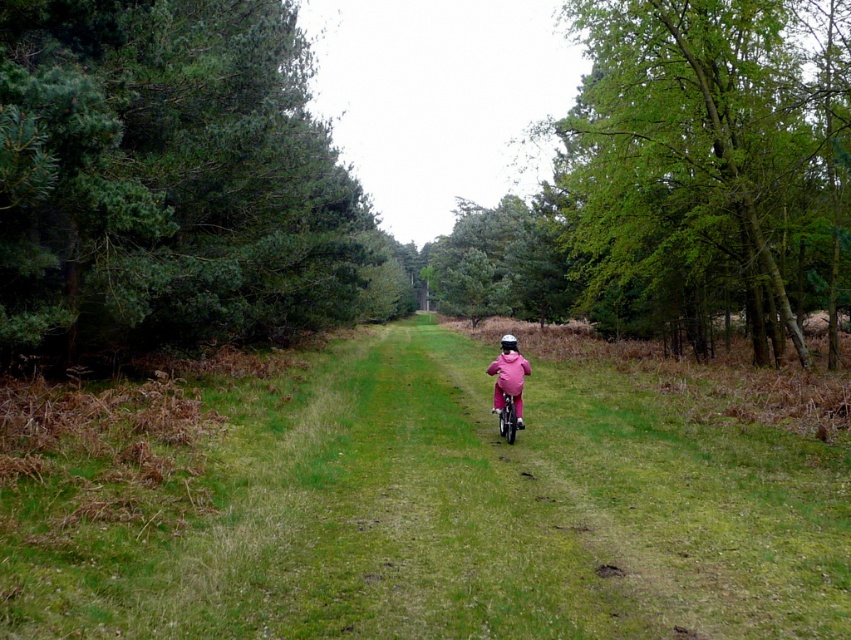
You are a cyclist on the path and want to know which tree is taller between the green textured pine trees at left and the green leafy tree at right. Based on the scene, which one is taller?

The green leafy tree at right is taller than the green textured pine trees at left.

You are a cyclist planning to ride along the path shown in the image. You notice the green textured pine trees at left and the pink matte bicycle at center. Which object is positioned higher relative to the other?

The green textured pine trees at left are positioned above the pink matte bicycle at center, meaning they are higher in the scene.